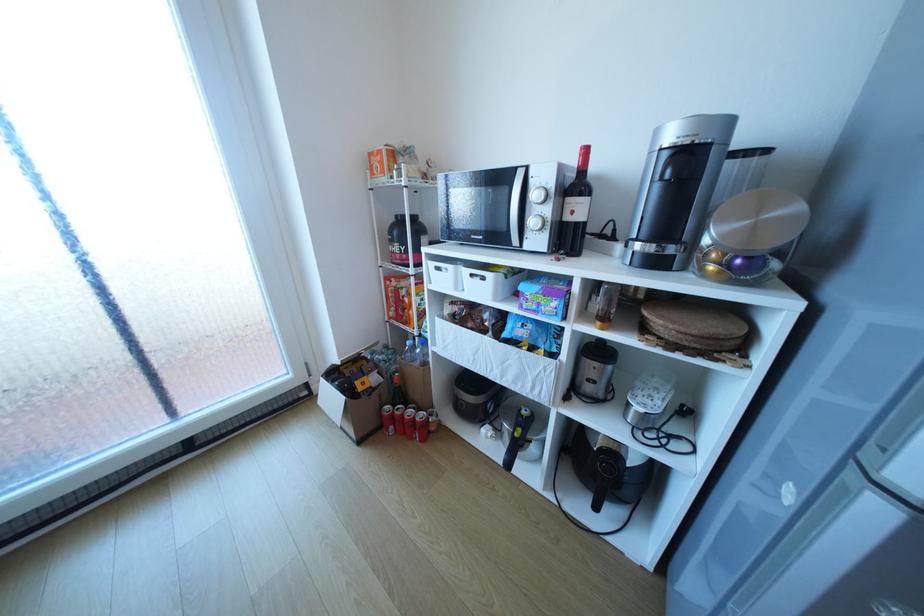
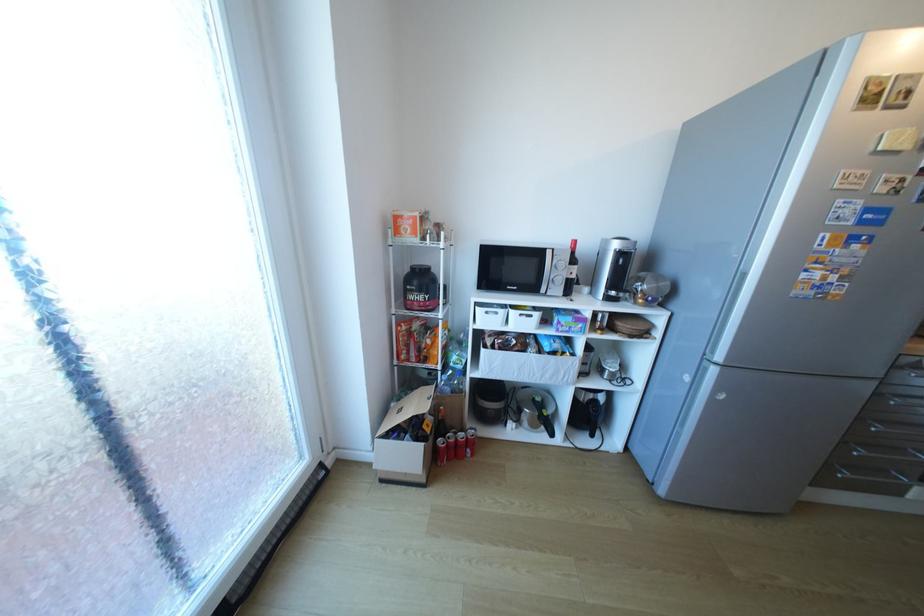
Locate, in the second image, the point that corresponds to [342,382] in the first image.

(407, 437)